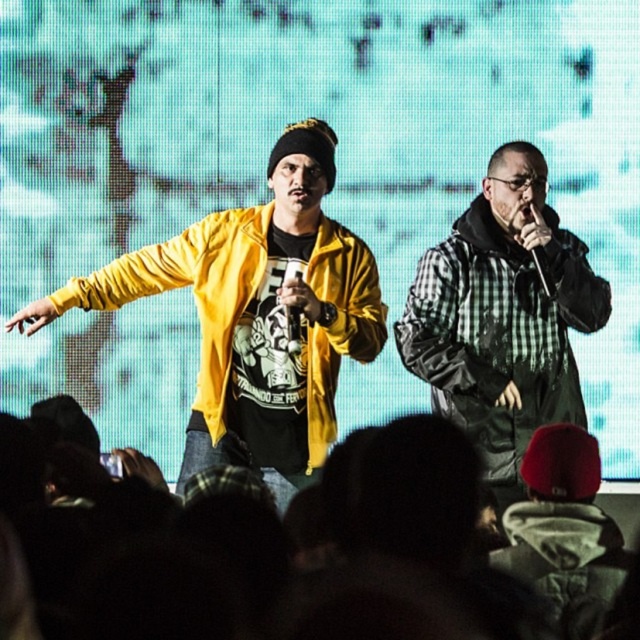
Question: Which of the following is the closest to the observer?

Choices:
 (A) (88, 582)
 (B) (554, 284)
 (C) (296, 332)
 (D) (301, 308)

Answer: (A)

Question: Which point is farther to the camera?

Choices:
 (A) (371, 586)
 (B) (481, 278)
 (C) (294, 320)
 (D) (211, 264)

Answer: (B)

Question: Which object is farther from the camera taking this photo?

Choices:
 (A) metallic silver microphone at center-right
 (B) checkered fabric jacket at right
 (C) dark fabric crowd at lower center

Answer: (A)

Question: Where is yellow matte jacket at left located in relation to metallic silver microphone at center in the image?

Choices:
 (A) right
 (B) left

Answer: (B)

Question: Does dark fabric crowd at lower center appear on the left side of metallic silver microphone at center-right?

Choices:
 (A) yes
 (B) no

Answer: (A)

Question: Does dark fabric crowd at lower center lie in front of metallic silver microphone at center-right?

Choices:
 (A) no
 (B) yes

Answer: (B)